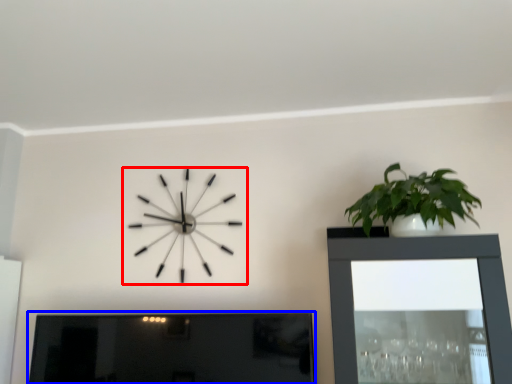
Question: Which object appears closest to the camera in this image, wall clock (highlighted by a red box) or picture frame (highlighted by a blue box)?

Choices:
 (A) wall clock
 (B) picture frame

Answer: (B)